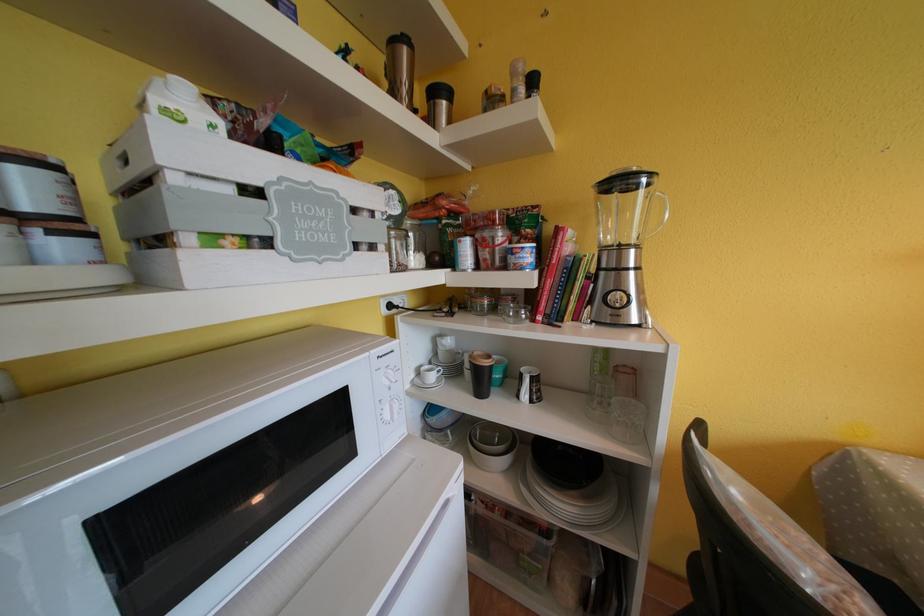
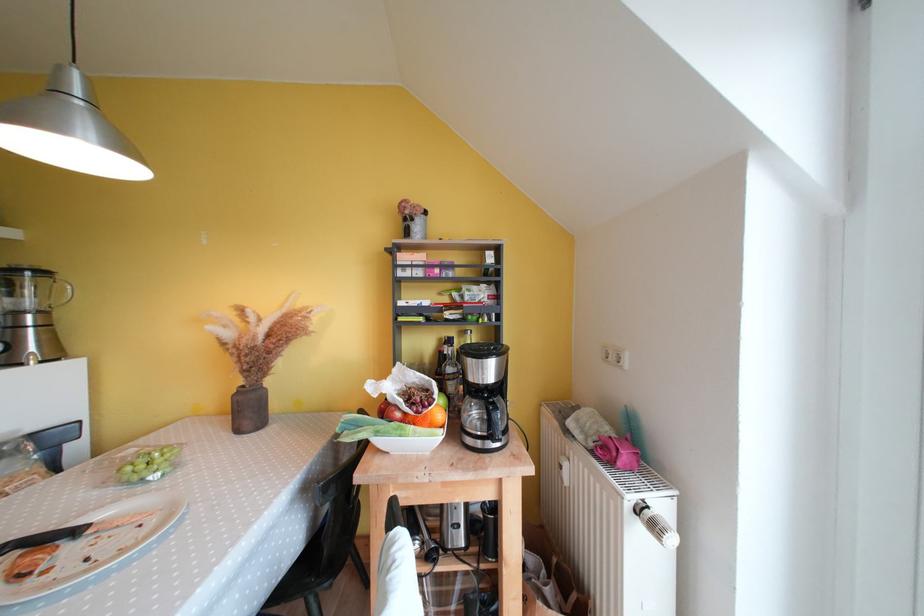
Find the pixel in the second image that matches pixel 641 251 in the first image.

(49, 315)